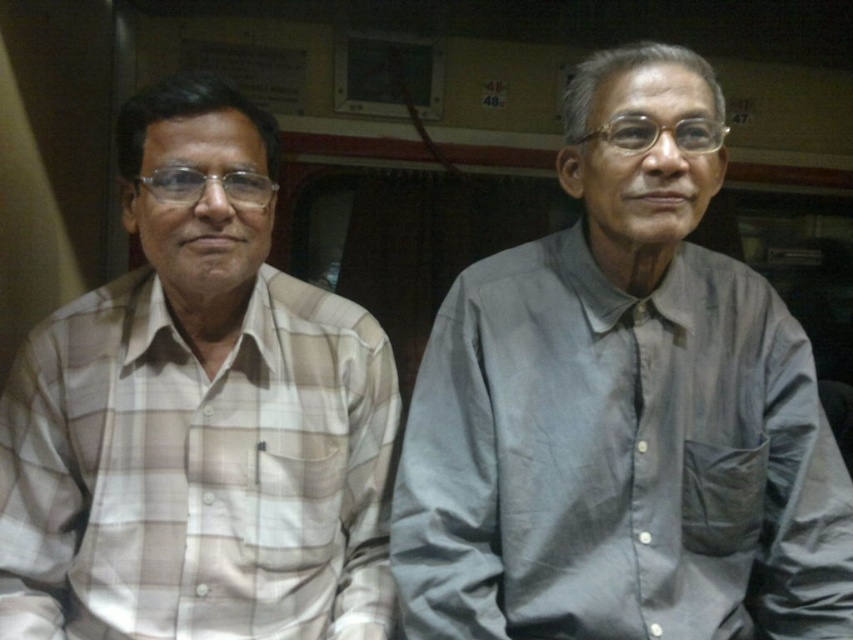
You are standing in the train compartment and want to place a small object exactly at the coordinates point [622,410]. Which person should you avoid placing it on to ensure it stays on the gray cotton shirt at right?

You should avoid placing the small object on the gray cotton shirt at right because the point [622,410] is located on the gray cotton shirt at right.

You are a photographer planning to take a portrait of both the gray cotton shirt at right and the light beige plaid shirt at left. Since you want to ensure both subjects are in focus, you need to know their heights relative to each other. Which shirt is taller?

The gray cotton shirt at right is taller than the light beige plaid shirt at left according to the description.